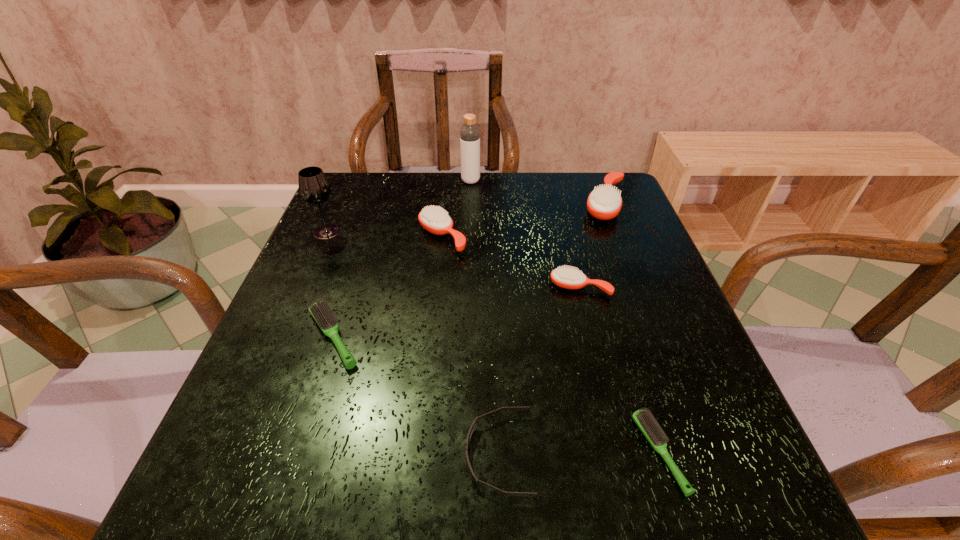
You are a GUI agent. You are given a task and a screenshot of the screen. Output one action in this format:
    pyautogui.click(x=<x>, y=<y>)
    Task: Click on the blank region between the shortest hairbrush and the second shortest hairbrush
    
    Given the screenshot: What is the action you would take?
    pyautogui.click(x=496, y=395)

Find the location of a particular element. vacant region between the second tallest object and the sunglasses is located at coordinates (413, 343).

Locate an element on the screen. Image resolution: width=960 pixels, height=540 pixels. vacant space in between the right light hairbrush and the sunglasses is located at coordinates (579, 454).

At what (x,y) coordinates should I click in order to perform the action: click on free space between the smaller light hairbrush and the leftmost object. Please return your answer as a coordinate pair (x, y). The width and height of the screenshot is (960, 540). Looking at the image, I should click on (493, 342).

Image resolution: width=960 pixels, height=540 pixels. I want to click on vacant space that's between the sunglasses and the fourth nearest object, so click(540, 371).

At what (x,y) coordinates should I click in order to perform the action: click on vacant region between the leftmost orange hairbrush and the sunglasses. Please return your answer as a coordinate pair (x, y). Looking at the image, I should click on (470, 346).

The height and width of the screenshot is (540, 960). I want to click on empty space between the leftmost object and the fourth shortest hairbrush, so click(384, 234).

Select which object is the fourth closest to the sunglasses. Please provide its 2D coordinates. Your answer should be formatted as a tuple, i.e. [(x, y)], where the tuple contains the x and y coordinates of a point satisfying the conditions above.

[(434, 219)]

Identify the location of the third closest object to the wineglass. (469, 133).

Where is `hairbrush that is the nearest to the third nearest hairbrush`? hairbrush that is the nearest to the third nearest hairbrush is located at coordinates (605, 202).